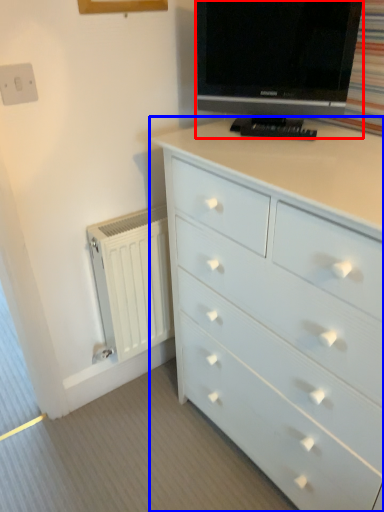
Question: Which object appears closest to the camera in this image, television (highlighted by a red box) or chest of drawers (highlighted by a blue box)?

Choices:
 (A) television
 (B) chest of drawers

Answer: (B)